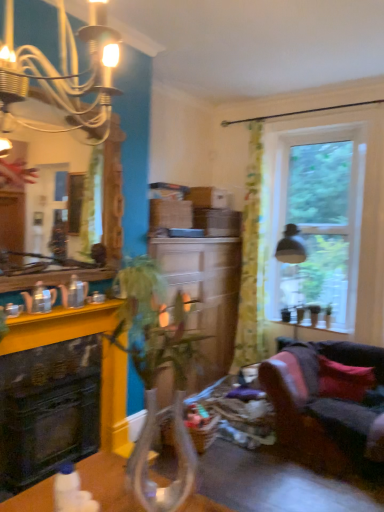
Question: Relative to wooden mirror at upper left, is translucent floral fabric curtain at right in front or behind?

Choices:
 (A) front
 (B) behind

Answer: (B)

Question: Is translucent floral fabric curtain at right taller or shorter than wooden mirror at upper left?

Choices:
 (A) tall
 (B) short

Answer: (A)

Question: Which object is positioned closest to the translucent floral fabric curtain at right?

Choices:
 (A) green leafy plant at center
 (B) clear glass window at upper right
 (C) yellow wood counter at left
 (D) velvet dark grey couch at lower right
 (E) pink fabric pillow at lower right

Answer: (B)

Question: Considering the real-world distances, which object is closest to the black glossy fireplace at left?

Choices:
 (A) clear glass window at upper right
 (B) velvet dark grey couch at lower right
 (C) wooden mirror at upper left
 (D) pink fabric pillow at lower right
 (E) translucent floral fabric curtain at right

Answer: (C)